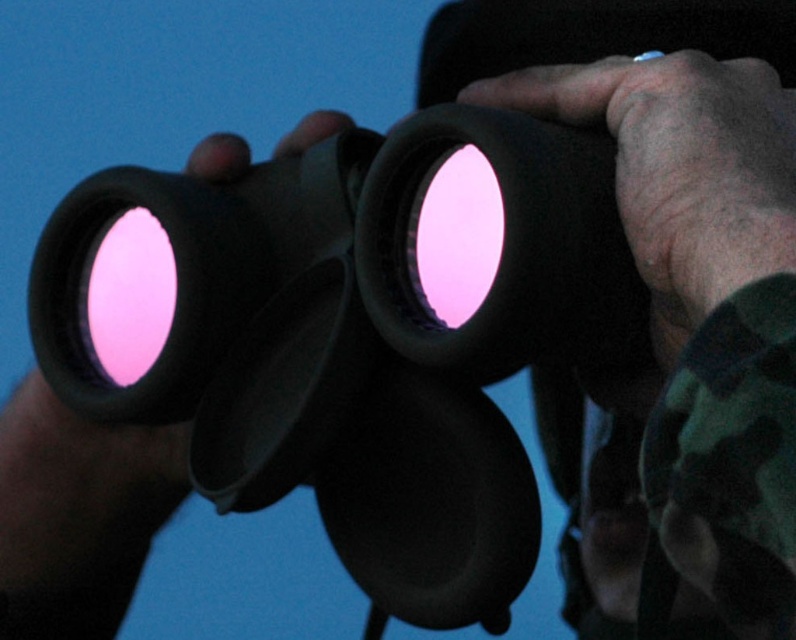
You are holding the matte black binoculars at center and want to check the camo fabric at center. In which direction should you move your gaze from the binoculars to see the camo fabric?

You should move your gaze to the right from the matte black binoculars at center to see the camo fabric at center because the camo fabric at center is located to the right of the matte black binoculars at center.